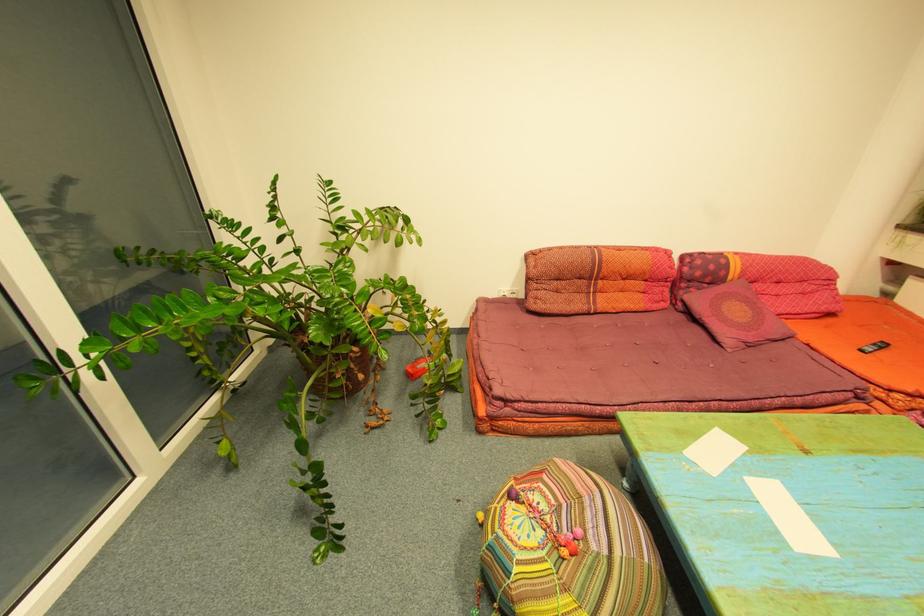
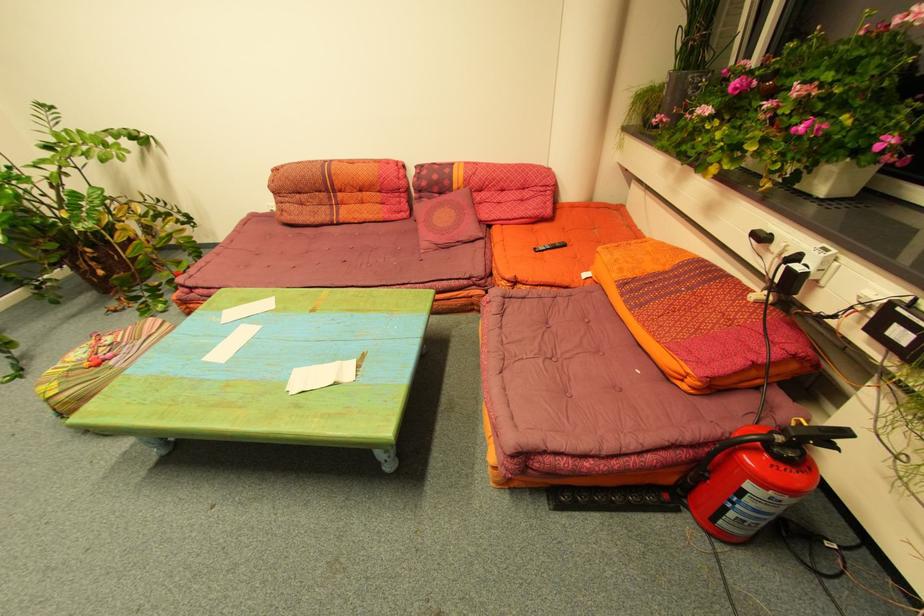
Question: The images are taken continuously from a first-person perspective. In which direction are you moving?

Choices:
 (A) Left
 (B) Right
 (C) Forward
 (D) Backward

Answer: (B)